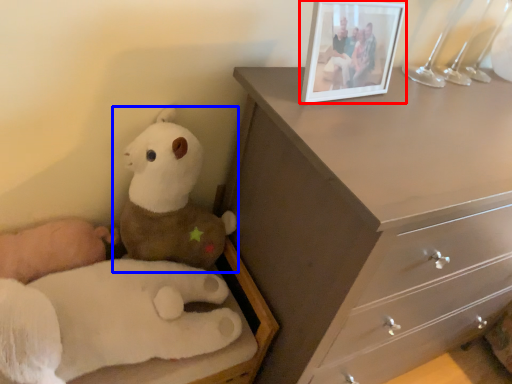
Question: Which object appears farthest to the camera in this image, picture frame (highlighted by a red box) or toy (highlighted by a blue box)?

Choices:
 (A) picture frame
 (B) toy

Answer: (B)